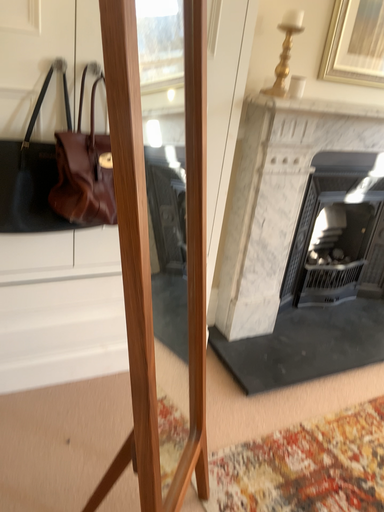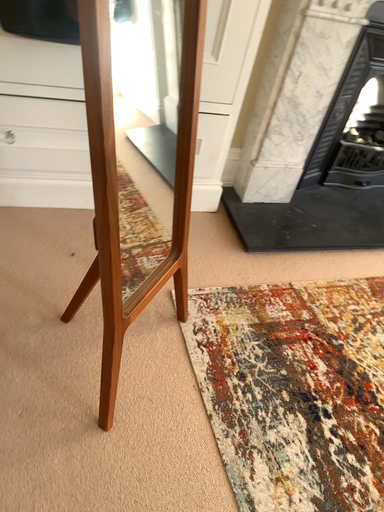
Question: Which way did the camera rotate in the video?

Choices:
 (A) rotated upward
 (B) rotated downward

Answer: (B)